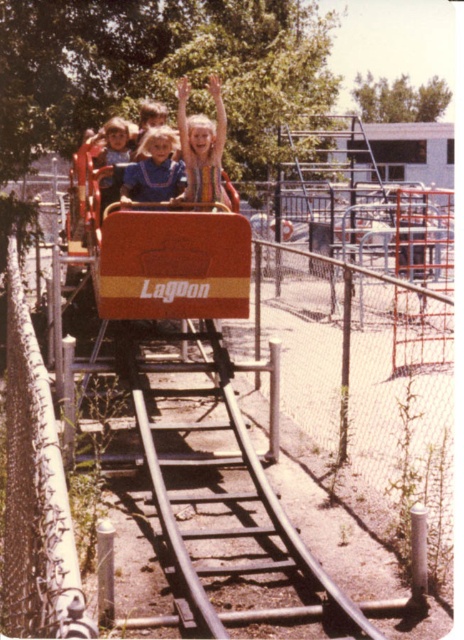
Can you confirm if striped dress at center is positioned to the right of matte blue shirt at center?

Indeed, striped dress at center is positioned on the right side of matte blue shirt at center.

Does striped dress at center have a larger size compared to matte blue shirt at center?

Incorrect, striped dress at center is not larger than matte blue shirt at center.

I want to click on striped dress at center, so click(201, 145).

Between striped dress at center and blonde hair at center, which one appears on the left side from the viewer's perspective?

Positioned to the left is blonde hair at center.

Is striped dress at center further to the viewer compared to blonde hair at center?

No, it is not.

At what (x,y) coordinates should I click in order to perform the action: click on striped dress at center. Please return your answer as a coordinate pair (x, y). This screenshot has height=640, width=464. Looking at the image, I should click on (201, 145).

At what (x,y) coordinates should I click in order to perform the action: click on striped dress at center. Please return your answer as a coordinate pair (x, y). The height and width of the screenshot is (640, 464). Looking at the image, I should click on (201, 145).

Is matte blue shirt at center bigger than blonde hair at center?

Yes, matte blue shirt at center is bigger than blonde hair at center.

Is matte blue shirt at center positioned in front of blonde hair at center?

Yes, it is.

Who is more forward, (139, 154) or (96, 154)?

Positioned in front is point (139, 154).

What are the coordinates of `matte blue shirt at center` in the screenshot? It's located at (154, 168).